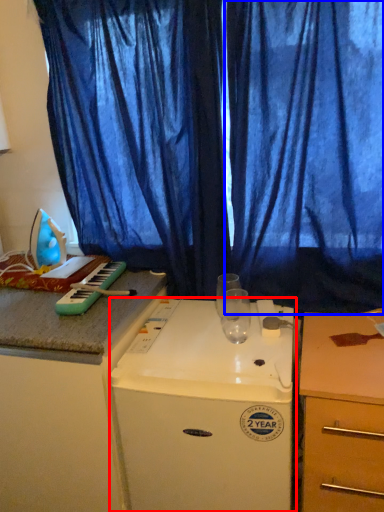
Question: Which point is closer to the camera, home appliance (highlighted by a red box) or curtain (highlighted by a blue box)?

Choices:
 (A) home appliance
 (B) curtain

Answer: (A)